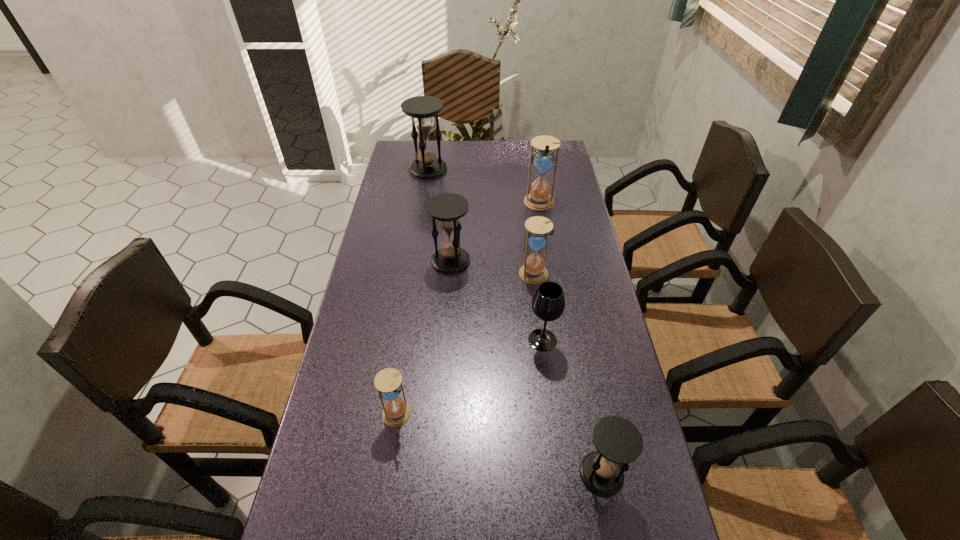
The height and width of the screenshot is (540, 960). Identify the location of the second nearest hourglass. (388, 382).

I want to click on the smallest white hourglass, so click(x=388, y=382).

Locate an element on the screen. This screenshot has height=540, width=960. free space located 0.120m on the right of the farthest hourglass is located at coordinates (477, 170).

This screenshot has width=960, height=540. Find the location of `free space located on the left of the second farthest hourglass`. free space located on the left of the second farthest hourglass is located at coordinates (448, 203).

At what (x,y) coordinates should I click in order to perform the action: click on vacant area situated 0.080m on the left of the second nearest black hourglass. Please return your answer as a coordinate pair (x, y). Looking at the image, I should click on (406, 261).

The image size is (960, 540). Find the location of `free region located on the left of the second nearest white hourglass`. free region located on the left of the second nearest white hourglass is located at coordinates (493, 275).

Image resolution: width=960 pixels, height=540 pixels. I want to click on free space located 0.380m on the front of the wineglass, so click(564, 508).

You are a GUI agent. You are given a task and a screenshot of the screen. Output one action in this format:
    pyautogui.click(x=<x>, y=<y>)
    Task: Click on the vacant area located on the back of the nearest black hourglass
    The height and width of the screenshot is (540, 960).
    Given the screenshot: What is the action you would take?
    pyautogui.click(x=587, y=395)

The image size is (960, 540). In order to click on blank space located on the back of the fifth farthest hourglass in this screenshot , I will do `click(403, 369)`.

Locate an element on the screen. The width and height of the screenshot is (960, 540). object that is positioned at the far edge is located at coordinates (422, 109).